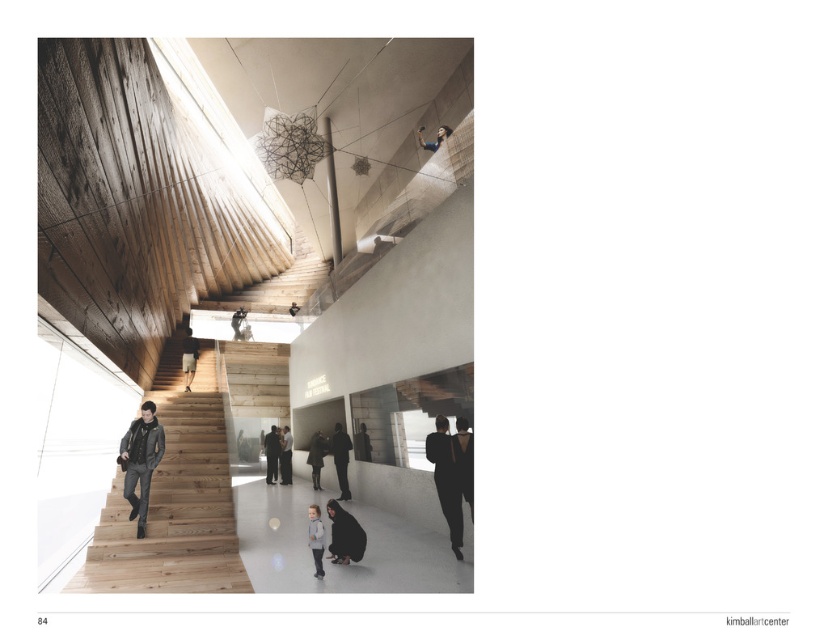
You are an interior designer assessing the placement of the dark brown leather jacket at lower right and the dark gray suit at center. Which item takes up more horizontal space?

The dark gray suit at center takes up more horizontal space because it is thicker than the dark brown leather jacket at lower right.

You are an interior designer assessing the placement of two jackets in a modern space. The scene includes a dark brown leather jacket at lower center and a matte black jacket at upper center. Which jacket is taller?

The dark brown leather jacket at lower center is taller than the matte black jacket at upper center.

You are standing at point (x=285, y=433) and want to walk to point (x=460, y=456). Which direction should you move in relation to the staircase?

Since point (x=460, y=456) is in front of point (x=285, y=433), you should move forward towards the staircase to reach your destination.